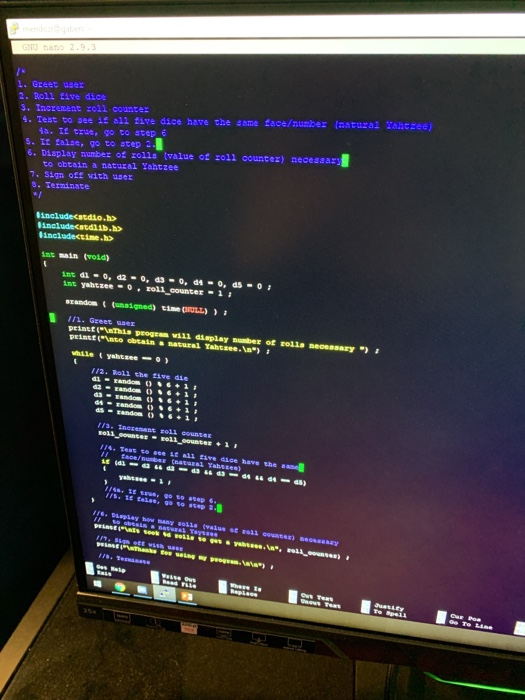
What are the coordinates of `computer monitor` in the screenshot? It's located at (409, 650).